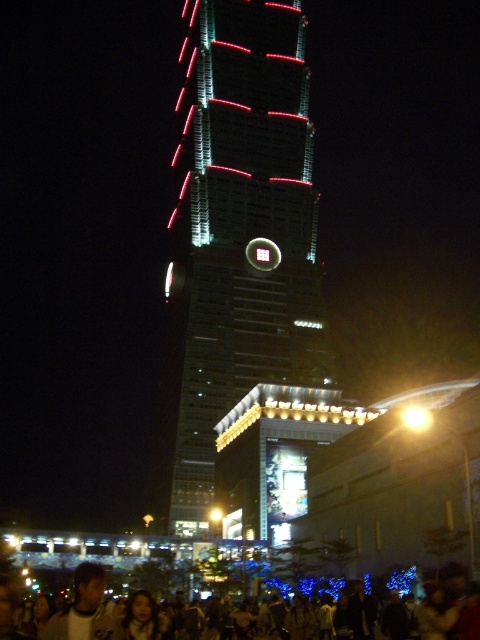
You are a photographer standing at the camera position. You want to capture a clear photo of the light brown hair at lower left. Considering the distance, will the subject be in focus if your camera has an autofocus range of 30 meters?

The distance between the light brown hair at lower left and the camera is 31.37 meters. Since the autofocus range is 30 meters, the camera may not be able to focus automatically on the subject. You might need to adjust the focus manually or move closer to ensure clarity.

Looking at this image, you are standing in front of the glassy reflective skyscraper at center and the dark clothing crowd at lower center. Which object appears narrower from your perspective?

The glassy reflective skyscraper at center is thinner than the dark clothing crowd at lower center, so it appears narrower from your perspective.